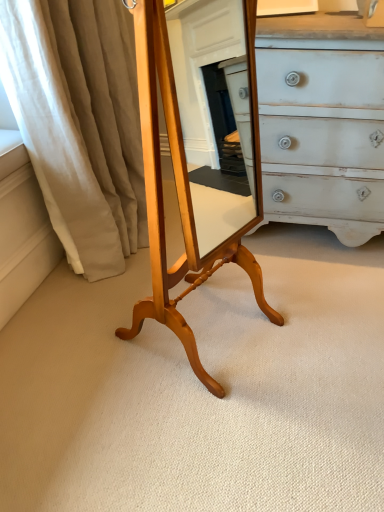
Question: Considering the relative sizes of beige fabric curtain at left and light brown wood table at center in the image provided, is beige fabric curtain at left shorter than light brown wood table at center?

Choices:
 (A) no
 (B) yes

Answer: (B)

Question: Considering the relative sizes of beige fabric curtain at left and light brown wood table at center in the image provided, is beige fabric curtain at left bigger than light brown wood table at center?

Choices:
 (A) yes
 (B) no

Answer: (A)

Question: From the image's perspective, is beige fabric curtain at left under light brown wood table at center?

Choices:
 (A) yes
 (B) no

Answer: (B)

Question: Could light brown wood table at center be considered to be inside beige fabric curtain at left?

Choices:
 (A) yes
 (B) no

Answer: (B)

Question: Does beige fabric curtain at left have a smaller size compared to light brown wood table at center?

Choices:
 (A) no
 (B) yes

Answer: (A)

Question: Is beige fabric curtain at left further to the viewer compared to light brown wood table at center?

Choices:
 (A) yes
 (B) no

Answer: (A)

Question: Is light brown wood table at center taller than beige fabric curtain at left?

Choices:
 (A) yes
 (B) no

Answer: (A)

Question: Is light brown wood table at center wider than beige fabric curtain at left?

Choices:
 (A) no
 (B) yes

Answer: (A)

Question: From the image's perspective, would you say light brown wood table at center is shown under beige fabric curtain at left?

Choices:
 (A) no
 (B) yes

Answer: (B)

Question: Are light brown wood table at center and beige fabric curtain at left making contact?

Choices:
 (A) no
 (B) yes

Answer: (A)

Question: Is light brown wood table at center bigger than beige fabric curtain at left?

Choices:
 (A) no
 (B) yes

Answer: (A)

Question: Considering the relative sizes of light brown wood table at center and beige fabric curtain at left in the image provided, is light brown wood table at center smaller than beige fabric curtain at left?

Choices:
 (A) no
 (B) yes

Answer: (B)

Question: Looking at their shapes, would you say light brown wood table at center is wider or thinner than beige fabric curtain at left?

Choices:
 (A) wide
 (B) thin

Answer: (B)